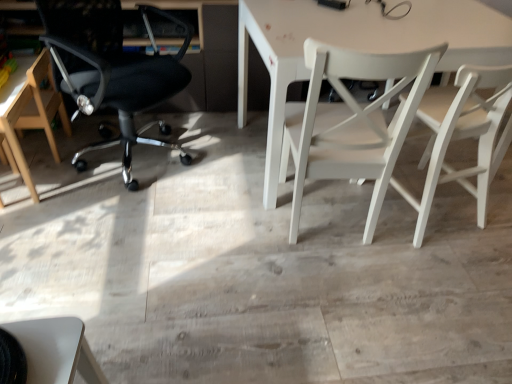
You are a GUI agent. You are given a task and a screenshot of the screen. Output one action in this format:
    pyautogui.click(x=<x>, y=<y>)
    Task: Click on the vacant area that lies to the right of black mesh office chair at left, the 2th chair in the left-to-right sequence
    
    Given the screenshot: What is the action you would take?
    pyautogui.click(x=223, y=173)